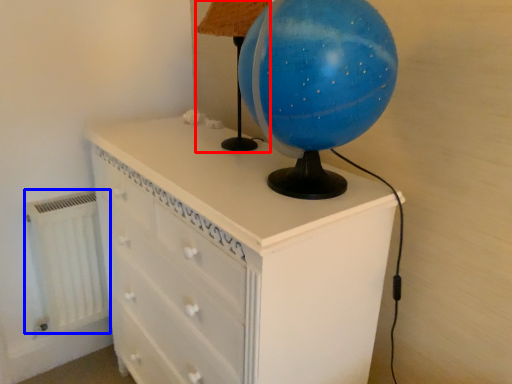
Question: Which of the following is the closest to the observer, table lamp (highlighted by a red box) or radiator (highlighted by a blue box)?

Choices:
 (A) table lamp
 (B) radiator

Answer: (A)